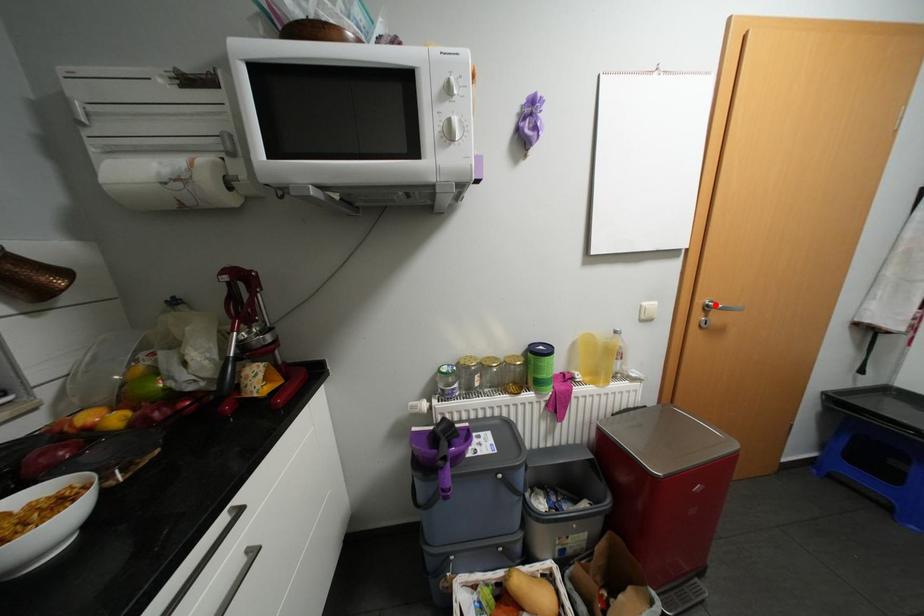
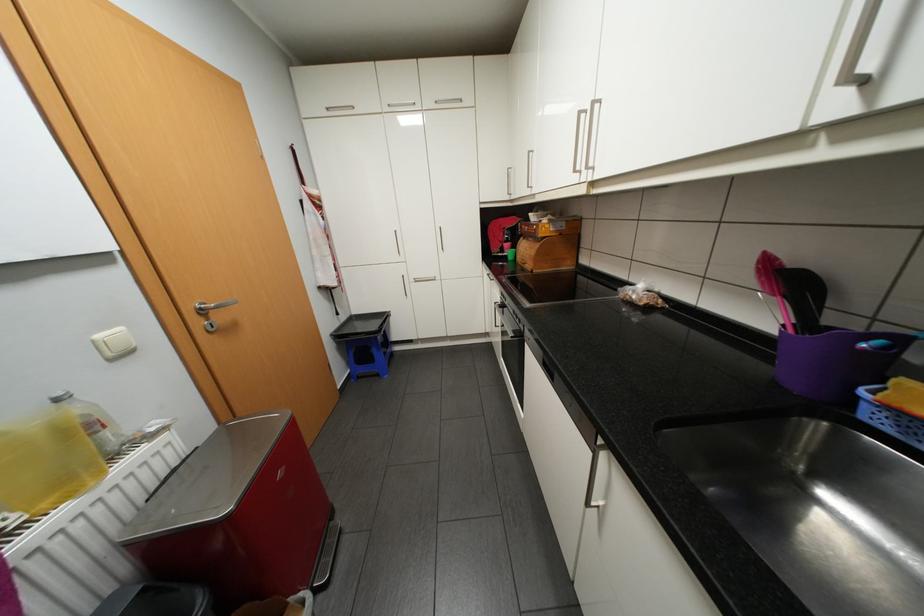
Locate, in the second image, the point that corresponds to the highlighted location in the first image.

(209, 308)